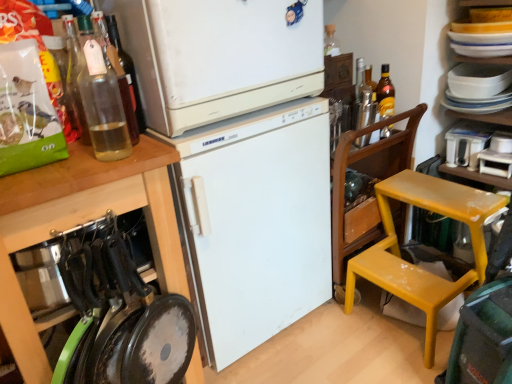
Image resolution: width=512 pixels, height=384 pixels. What do you see at coordinates (467, 143) in the screenshot?
I see `white plastic container at upper right, the first appliance from the bottom` at bounding box center [467, 143].

Locate an element on the screen. The width and height of the screenshot is (512, 384). white glossy bowls at upper right, arranged as the first appliance when viewed from the top is located at coordinates (478, 80).

The height and width of the screenshot is (384, 512). What are the coordinates of `clear glass bottle at upper left, placed as the fourth bottle when sorted from right to left` in the screenshot? It's located at click(x=102, y=104).

What do you see at coordinates (366, 111) in the screenshot? This screenshot has width=512, height=384. I see `metallic silver shaker at upper right, arranged as the 2th bottle when viewed from the back` at bounding box center [366, 111].

The width and height of the screenshot is (512, 384). I want to click on translucent glass bottle at upper left, the second bottle from the left, so click(x=127, y=81).

Can you confirm if clear glass bottle at upper left, which appears as the 1th bottle when viewed from the left, is wider than white matte refrigerator at upper center, arranged as the 1th refrigerator when viewed from the top?

In fact, clear glass bottle at upper left, which appears as the 1th bottle when viewed from the left, might be narrower than white matte refrigerator at upper center, arranged as the 1th refrigerator when viewed from the top.

Can you confirm if clear glass bottle at upper left, marked as the 1th bottle in a front-to-back arrangement, is smaller than white matte refrigerator at upper center, placed as the second refrigerator when sorted from bottom to top?

Yes, clear glass bottle at upper left, marked as the 1th bottle in a front-to-back arrangement, is smaller than white matte refrigerator at upper center, placed as the second refrigerator when sorted from bottom to top.

Can you confirm if clear glass bottle at upper left, which is the 4th bottle in back-to-front order, is positioned to the right of white matte refrigerator at upper center, arranged as the 1th refrigerator when viewed from the top?

No, clear glass bottle at upper left, which is the 4th bottle in back-to-front order, is not to the right of white matte refrigerator at upper center, arranged as the 1th refrigerator when viewed from the top.

From a real-world perspective, relative to white matte refrigerator at upper center, arranged as the 1th refrigerator when viewed from the top, is yellow plastic chair at right vertically above or below?

yellow plastic chair at right is situated lower than white matte refrigerator at upper center, arranged as the 1th refrigerator when viewed from the top, in the real world.

What's the angular difference between yellow plastic chair at right and white matte refrigerator at upper center, arranged as the 1th refrigerator when viewed from the top,'s facing directions?

There is a 88.8-degree angle between the facing directions of yellow plastic chair at right and white matte refrigerator at upper center, arranged as the 1th refrigerator when viewed from the top.

Is yellow plastic chair at right not within white matte refrigerator at upper center, placed as the second refrigerator when sorted from bottom to top?

That's correct, yellow plastic chair at right is outside of white matte refrigerator at upper center, placed as the second refrigerator when sorted from bottom to top.

Considering the relative sizes of yellow plastic chair at right and white matte refrigerator at upper center, placed as the second refrigerator when sorted from bottom to top, in the image provided, is yellow plastic chair at right shorter than white matte refrigerator at upper center, placed as the second refrigerator when sorted from bottom to top,?

No, yellow plastic chair at right is not shorter than white matte refrigerator at upper center, placed as the second refrigerator when sorted from bottom to top.

Is white plastic container at upper right, the first appliance from the bottom, a part of white matte refrigerator at upper center, placed as the second refrigerator when sorted from bottom to top?

No, white matte refrigerator at upper center, placed as the second refrigerator when sorted from bottom to top, does not contain white plastic container at upper right, the first appliance from the bottom.

From a real-world perspective, between white matte refrigerator at upper center, placed as the second refrigerator when sorted from bottom to top, and white plastic container at upper right, marked as the second appliance in a top-to-bottom arrangement, who is vertically lower?

In real-world perspective, white plastic container at upper right, marked as the second appliance in a top-to-bottom arrangement, is lower.

From the white matte refrigerator at upper center, arranged as the 1th refrigerator when viewed from the top, count 1st appliance to the right and point to it. Please provide its 2D coordinates.

[(467, 143)]

Does white matte refrigerator at upper center, placed as the second refrigerator when sorted from bottom to top, appear on the left side of white plastic container at upper right, marked as the second appliance in a top-to-bottom arrangement?

Correct, you'll find white matte refrigerator at upper center, placed as the second refrigerator when sorted from bottom to top, to the left of white plastic container at upper right, marked as the second appliance in a top-to-bottom arrangement.

From the image's perspective, which is below, white matte refrigerator at center, which is the second refrigerator in top-to-bottom order, or translucent glass bottle at upper right, the 1th bottle from the right?

white matte refrigerator at center, which is the second refrigerator in top-to-bottom order, is shown below in the image.

Is white matte refrigerator at center, which is the second refrigerator in top-to-bottom order, not close to translucent glass bottle at upper right, the 1th bottle from the right?

That's not correct — white matte refrigerator at center, which is the second refrigerator in top-to-bottom order, is a little close to translucent glass bottle at upper right, the 1th bottle from the right.

Considering the sizes of objects white matte refrigerator at center, which appears as the first refrigerator when ordered from the bottom, and translucent glass bottle at upper right, acting as the fourth bottle starting from the left, in the image provided, who is smaller, white matte refrigerator at center, which appears as the first refrigerator when ordered from the bottom, or translucent glass bottle at upper right, acting as the fourth bottle starting from the left,?

Smaller between the two is translucent glass bottle at upper right, acting as the fourth bottle starting from the left.

Which refrigerator is the 1st one when counting from the back of the white matte cabinet at left? Please provide its 2D coordinates.

[(218, 57)]

Based on the photo, which is correct: white matte cabinet at left is inside white matte refrigerator at upper center, arranged as the 1th refrigerator when viewed from the top, or outside of it?

white matte cabinet at left lies outside white matte refrigerator at upper center, arranged as the 1th refrigerator when viewed from the top.

Considering the sizes of objects white matte cabinet at left and white matte refrigerator at upper center, placed as the second refrigerator when sorted from bottom to top, in the image provided, who is smaller, white matte cabinet at left or white matte refrigerator at upper center, placed as the second refrigerator when sorted from bottom to top,?

Smaller between the two is white matte refrigerator at upper center, placed as the second refrigerator when sorted from bottom to top.

Looking at this image, how far apart are metallic silver shaker at upper right, the 3th bottle viewed from the front, and white glossy bowls at upper right, arranged as the first appliance when viewed from the top?

They are 15.18 inches apart.

Is metallic silver shaker at upper right, positioned as the third bottle in left-to-right order, inside the boundaries of white glossy bowls at upper right, the 2th appliance ordered from the bottom, or outside?

metallic silver shaker at upper right, positioned as the third bottle in left-to-right order, is spatially situated outside white glossy bowls at upper right, the 2th appliance ordered from the bottom.

Is metallic silver shaker at upper right, the second bottle viewed from the right, facing towards white glossy bowls at upper right, arranged as the first appliance when viewed from the top?

No, metallic silver shaker at upper right, the second bottle viewed from the right, is not aimed at white glossy bowls at upper right, arranged as the first appliance when viewed from the top.

From the picture: Which is more to the right, white glossy bowls at upper right, the 2th appliance ordered from the bottom, or yellow plastic chair at right?

white glossy bowls at upper right, the 2th appliance ordered from the bottom.

Which of these two, white glossy bowls at upper right, the 2th appliance ordered from the bottom, or yellow plastic chair at right, is thinner?

white glossy bowls at upper right, the 2th appliance ordered from the bottom.

In the scene shown: Does white glossy bowls at upper right, the 2th appliance ordered from the bottom, have a greater height compared to yellow plastic chair at right?

No, white glossy bowls at upper right, the 2th appliance ordered from the bottom, is not taller than yellow plastic chair at right.

Find the location of a particular element. The image size is (512, 384). bottle that is the 2nd one when counting leftward from the white matte refrigerator at upper center, placed as the second refrigerator when sorted from bottom to top is located at coordinates (102, 104).

From the yellow plastic chair at right, count 2nd refrigerators forward and point to it. Please provide its 2D coordinates.

[(218, 57)]

Estimate the real-world distances between objects in this image. Which object is further from translucent glass bottle at upper left, the third bottle in the back-to-front sequence, white plastic container at upper right, marked as the second appliance in a top-to-bottom arrangement, or translucent glass bottle at upper right, positioned as the fourth bottle in front-to-back order?

The object further to translucent glass bottle at upper left, the third bottle in the back-to-front sequence, is white plastic container at upper right, marked as the second appliance in a top-to-bottom arrangement.

Based on their spatial positions, is white matte refrigerator at upper center, placed as the second refrigerator when sorted from bottom to top, or metallic silver shaker at upper right, the 3th bottle viewed from the front, closer to translucent glass bottle at upper right, the 1th bottle when ordered from back to front?

metallic silver shaker at upper right, the 3th bottle viewed from the front, is closer to translucent glass bottle at upper right, the 1th bottle when ordered from back to front.

From the image, which object appears to be nearer to metallic silver shaker at upper right, positioned as the third bottle in left-to-right order, translucent glass bottle at upper right, the 1th bottle from the right, or white matte refrigerator at center, which is the second refrigerator in top-to-bottom order?

translucent glass bottle at upper right, the 1th bottle from the right, lies closer to metallic silver shaker at upper right, positioned as the third bottle in left-to-right order, than the other object.

Estimate the real-world distances between objects in this image. Which object is further from clear glass bottle at upper left, which is the 4th bottle in back-to-front order, translucent glass bottle at upper right, acting as the fourth bottle starting from the left, or white glossy bowls at upper right, arranged as the first appliance when viewed from the top?

Among the two, white glossy bowls at upper right, arranged as the first appliance when viewed from the top, is located further to clear glass bottle at upper left, which is the 4th bottle in back-to-front order.

Estimate the real-world distances between objects in this image. Which object is further from metallic silver shaker at upper right, arranged as the 2th bottle when viewed from the back, white plastic container at upper right, the first appliance from the bottom, or white matte cabinet at left?

white matte cabinet at left.

Based on their spatial positions, is white matte refrigerator at center, which is the second refrigerator in top-to-bottom order, or clear glass bottle at upper left, which is the 4th bottle in back-to-front order, closer to translucent glass bottle at upper left, marked as the third bottle in a right-to-left arrangement?

clear glass bottle at upper left, which is the 4th bottle in back-to-front order, is closer to translucent glass bottle at upper left, marked as the third bottle in a right-to-left arrangement.

From the picture: When comparing their distances from metallic silver shaker at upper right, the 3th bottle viewed from the front, does white matte refrigerator at upper center, arranged as the 1th refrigerator when viewed from the top, or white plastic container at upper right, marked as the second appliance in a top-to-bottom arrangement, seem closer?

white plastic container at upper right, marked as the second appliance in a top-to-bottom arrangement, is closer to metallic silver shaker at upper right, the 3th bottle viewed from the front.

When comparing their distances from white matte refrigerator at upper center, placed as the second refrigerator when sorted from bottom to top, does yellow plastic chair at right or white matte cabinet at left seem further?

yellow plastic chair at right lies further to white matte refrigerator at upper center, placed as the second refrigerator when sorted from bottom to top, than the other object.

I want to click on bottle between clear glass bottle at upper left, which is the 4th bottle in back-to-front order, and white matte refrigerator at upper center, placed as the second refrigerator when sorted from bottom to top, so click(127, 81).

Where is `appliance between translucent glass bottle at upper left, the second bottle viewed from the front, and white glossy bowls at upper right, arranged as the first appliance when viewed from the top, from left to right`? The image size is (512, 384). appliance between translucent glass bottle at upper left, the second bottle viewed from the front, and white glossy bowls at upper right, arranged as the first appliance when viewed from the top, from left to right is located at coordinates (467, 143).

Identify the location of appliance that lies between translucent glass bottle at upper right, positioned as the fourth bottle in front-to-back order, and yellow plastic chair at right from top to bottom. (467, 143).

Find the location of a particular element. The image size is (512, 384). appliance between clear glass bottle at upper left, marked as the 1th bottle in a front-to-back arrangement, and white glossy bowls at upper right, the 2th appliance ordered from the bottom is located at coordinates (467, 143).